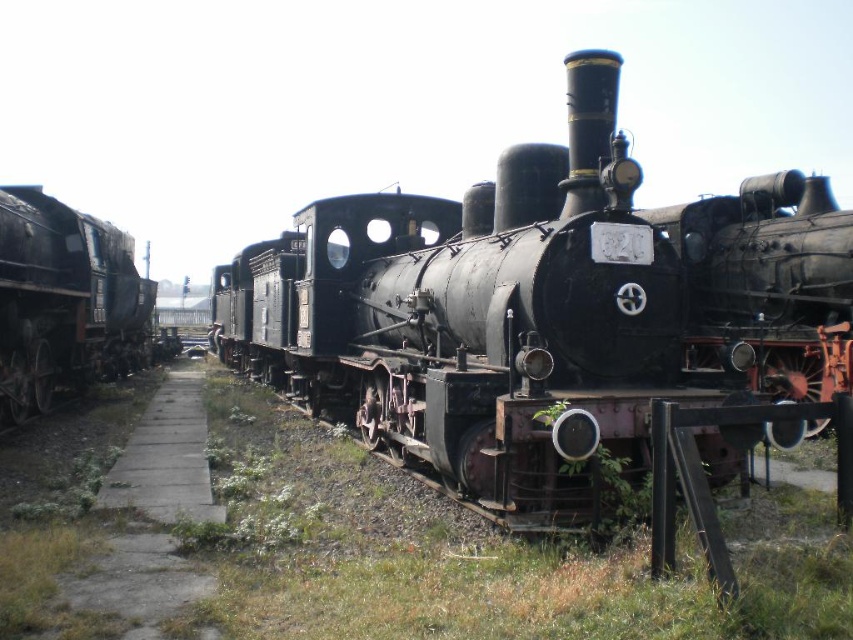
Can you confirm if black matte locomotive at center is positioned to the right of rusty metal train at left?

Correct, you'll find black matte locomotive at center to the right of rusty metal train at left.

This screenshot has width=853, height=640. Find the location of `black matte locomotive at center`. black matte locomotive at center is located at coordinates (543, 307).